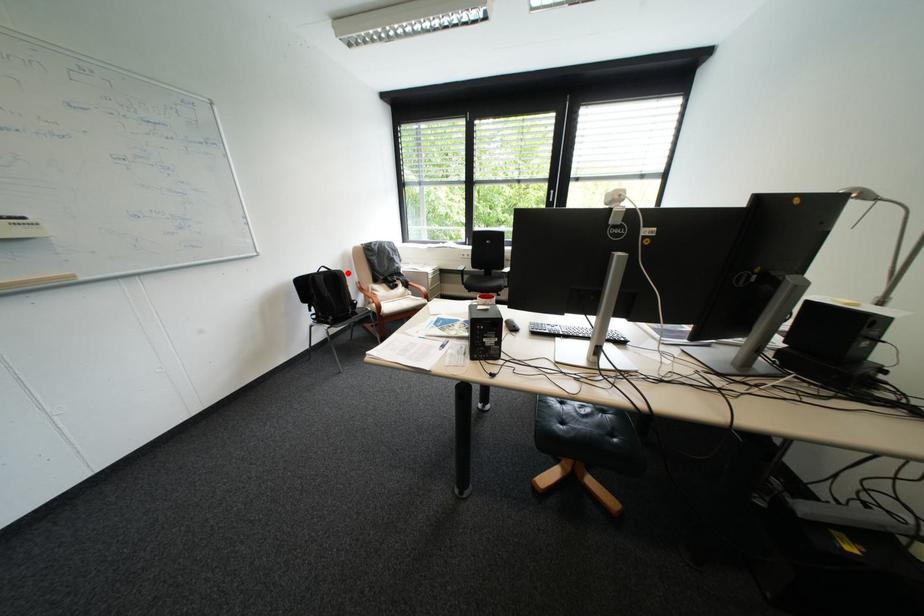
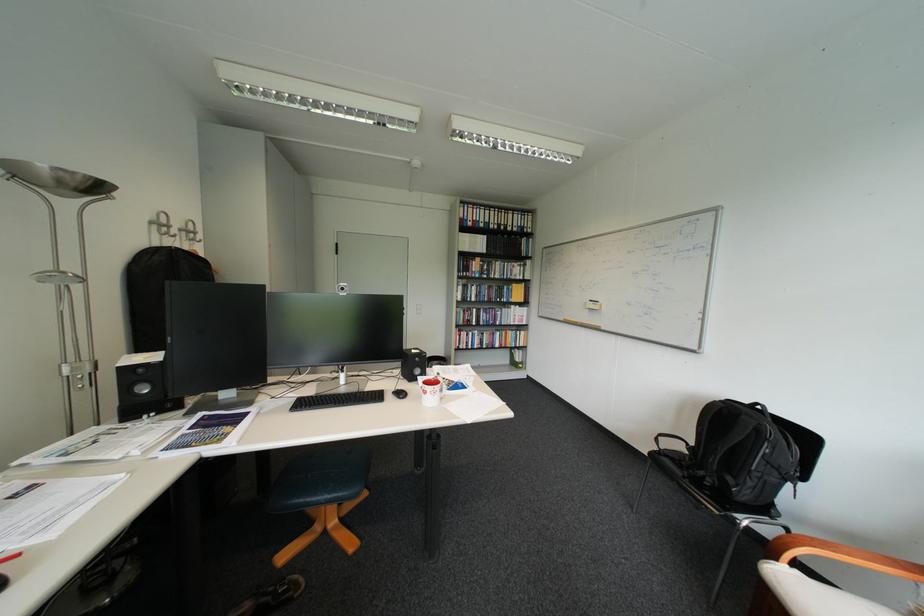
Question: I am providing you with two images of the same scene from different viewpoints. A red point is shown in image1. For the corresponding object point in image2, is it positioned nearer or farther from the camera?

Choices:
 (A) Nearer
 (B) Farther

Answer: (B)